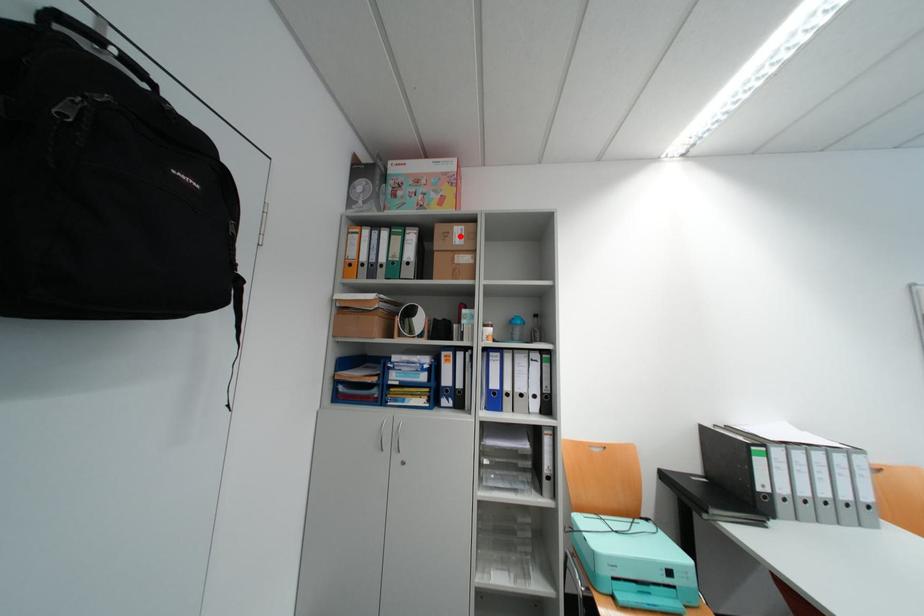
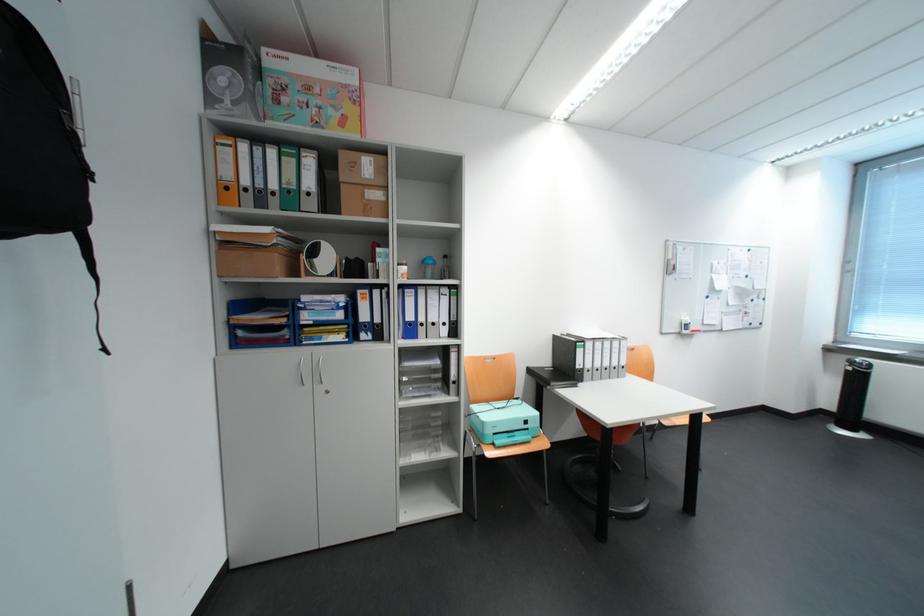
Question: I am providing you with two images of the same scene from different viewpoints. A red point is marked on the first image. Can you still see the location of the red point in image 2?

Choices:
 (A) Yes
 (B) No

Answer: (A)